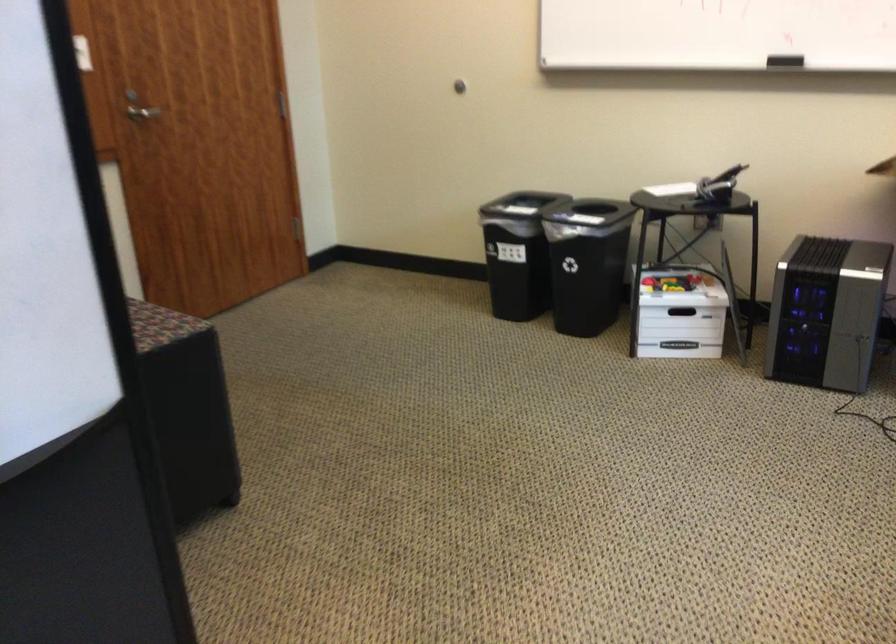
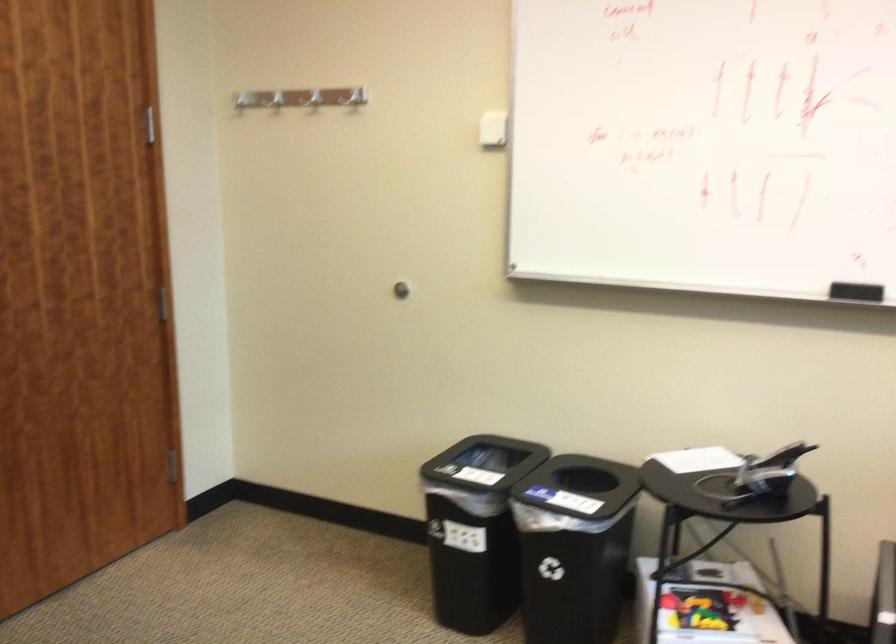
Question: Which direction would the cameraman need to move to produce the second image? Reply with the corresponding letter.

Choices:
 (A) Left
 (B) Right
 (C) Forward
 (D) Backward

Answer: (C)